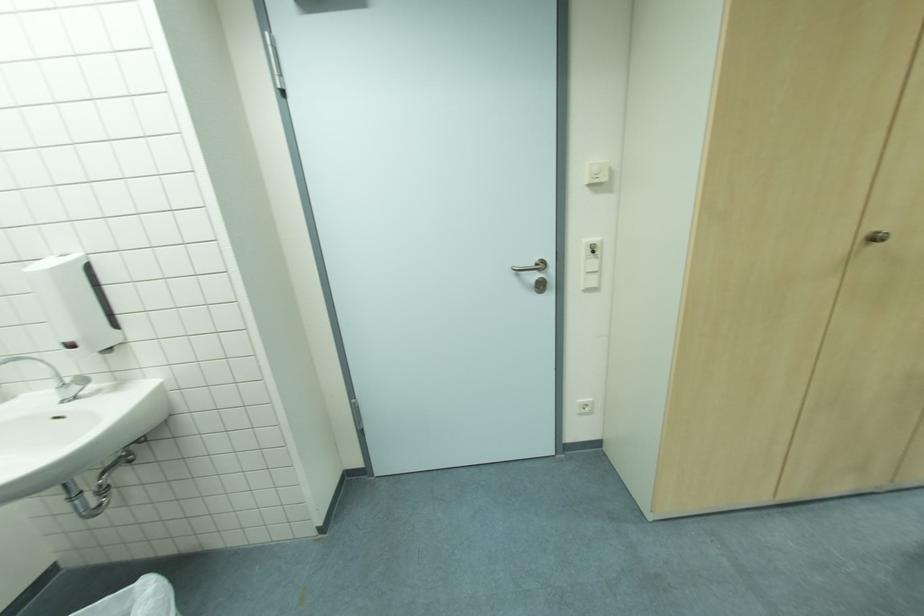
Where would you turn the white wall dial? Please return your answer as a coordinate pair (x, y).

(597, 172)